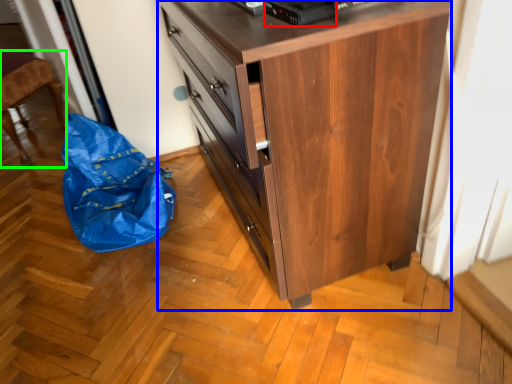
Question: Based on their relative distances, which object is nearer to appliance (highlighted by a red box)? Choose from chest of drawers (highlighted by a blue box) and furniture (highlighted by a green box).

Choices:
 (A) chest of drawers
 (B) furniture

Answer: (A)